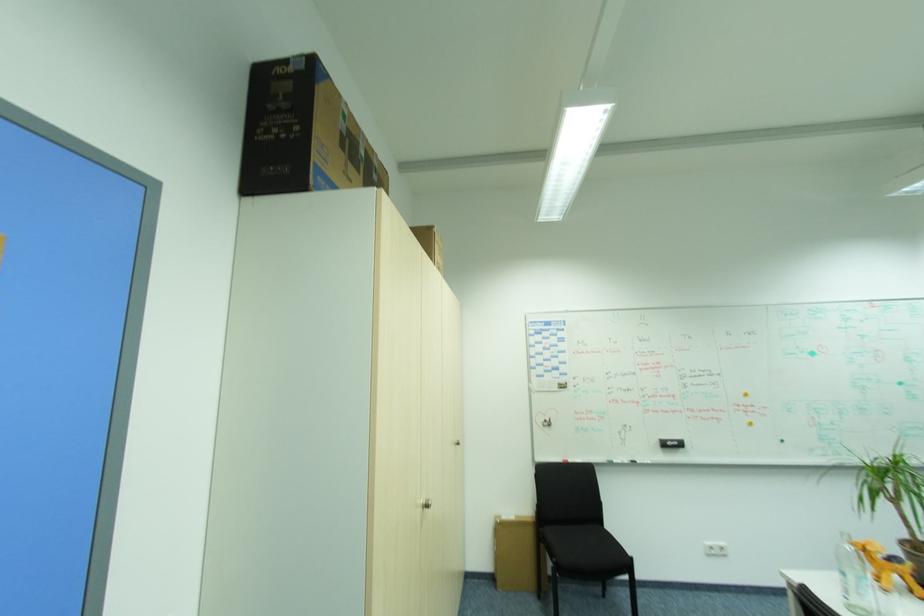
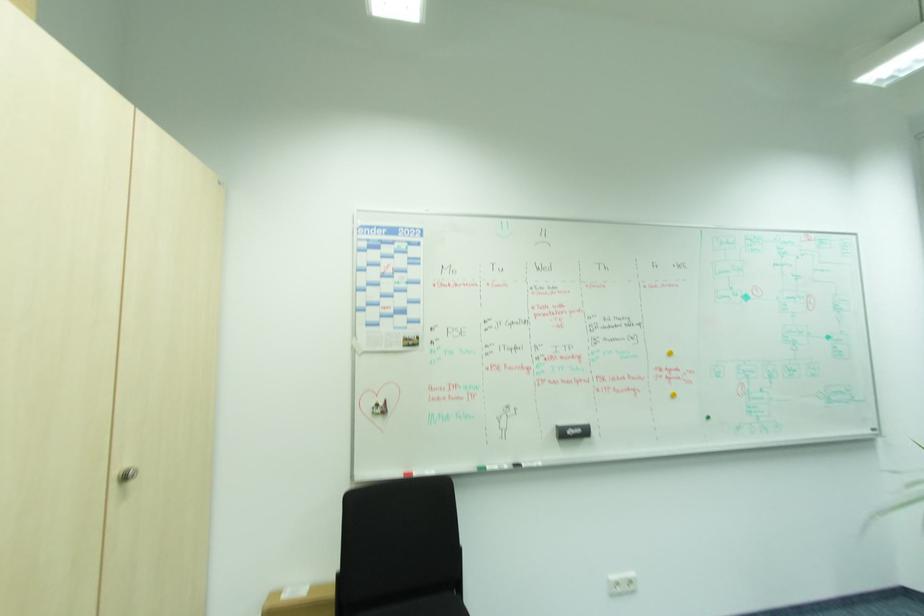
In the second image, find the point that corresponds to point (616, 464) in the first image.

(487, 471)